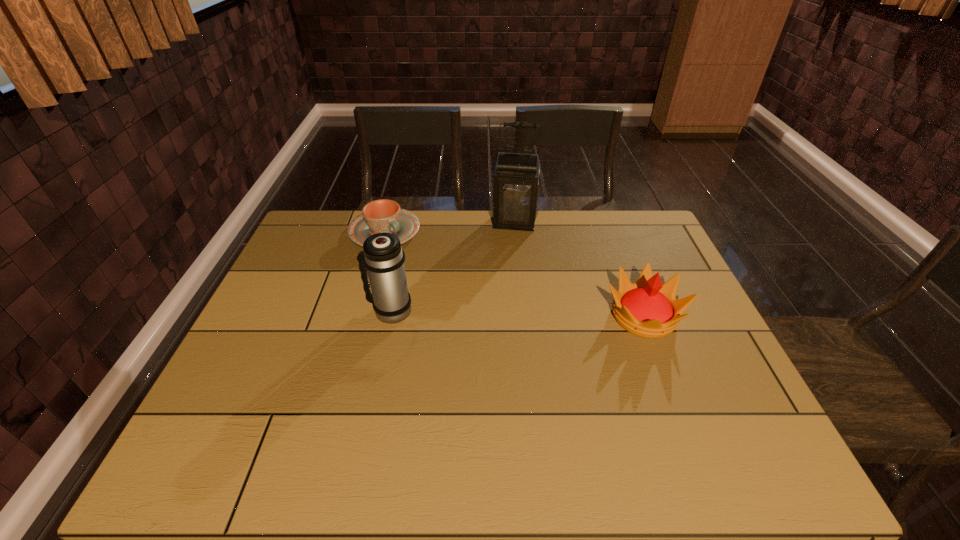
Where is `thermos bottle`? thermos bottle is located at coordinates (383, 256).

You are a GUI agent. You are given a task and a screenshot of the screen. Output one action in this format:
    pyautogui.click(x=<x>, y=<y>)
    Task: Click on the second shortest object
    This screenshot has height=540, width=960.
    Given the screenshot: What is the action you would take?
    pyautogui.click(x=647, y=308)

Locate an element on the screen. The image size is (960, 540). the rightmost object is located at coordinates (647, 308).

Identify the location of the tallest object. (516, 185).

Find the location of a particular element. The image size is (960, 540). lantern is located at coordinates (516, 185).

Where is `the shortest object`? This screenshot has height=540, width=960. the shortest object is located at coordinates (380, 216).

This screenshot has height=540, width=960. Identify the location of vacant space located on the side with the handle of the thermos bottle. (261, 310).

This screenshot has height=540, width=960. I want to click on free space located on the side with the handle of the thermos bottle, so click(269, 310).

At what (x,y) coordinates should I click in order to perform the action: click on blank space located on the side with the handle of the thermos bottle. Please return your answer as a coordinate pair (x, y). This screenshot has height=540, width=960. Looking at the image, I should click on (349, 310).

This screenshot has height=540, width=960. What are the coordinates of `vacant space located 0.380m on the left of the second shortest object` in the screenshot? It's located at (463, 316).